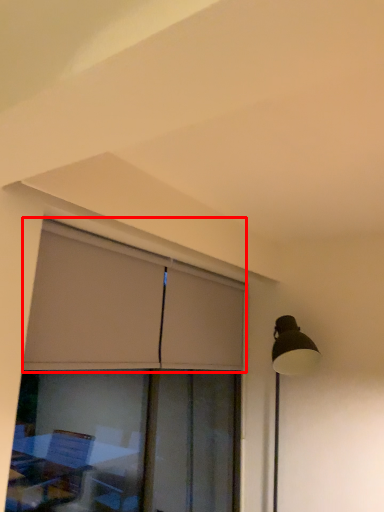
Question: From the image's perspective, considering the relative positions of curtain (annotated by the red box) and window in the image provided, where is curtain (annotated by the red box) located with respect to the staircase?

Choices:
 (A) above
 (B) below

Answer: (A)